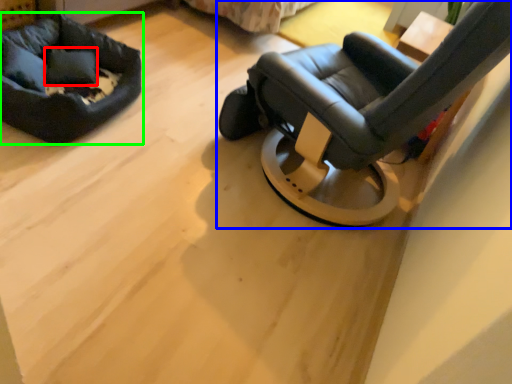
Question: Which object is the farthest from pillow (highlighted by a red box)? Choose among these: chair (highlighted by a blue box) or dog bed (highlighted by a green box).

Choices:
 (A) chair
 (B) dog bed

Answer: (A)